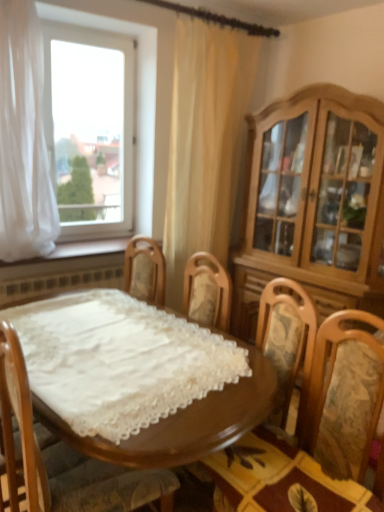
What do you see at coordinates (138, 378) in the screenshot? The width and height of the screenshot is (384, 512). I see `wooden table at center` at bounding box center [138, 378].

What do you see at coordinates (23, 138) in the screenshot?
I see `white sheer curtain at left, which appears as the 2th curtain when viewed from the right` at bounding box center [23, 138].

Identify the location of transparent glass window at upper left. (137, 91).

Is wooden at lower left looking in the opposite direction of wooden chair with floral cushion at center?

No, wooden at lower left's orientation is not away from wooden chair with floral cushion at center.

Is wooden at lower left directly adjacent to wooden chair with floral cushion at center?

wooden at lower left and wooden chair with floral cushion at center are not in contact.

Considering the relative sizes of wooden at lower left and wooden chair with floral cushion at center in the image provided, is wooden at lower left bigger than wooden chair with floral cushion at center?

Actually, wooden at lower left might be smaller than wooden chair with floral cushion at center.

Does point (116, 245) come closer to viewer compared to point (9, 369)?

No, it is not.

Considering the sizes of objects wooden at lower left and wooden table at center in the image provided, who is wider, wooden at lower left or wooden table at center?

wooden table at center is wider.

Do you think wooden at lower left is within wooden table at center, or outside of it?

wooden at lower left cannot be found inside wooden table at center.

Is wooden at lower left next to wooden table at center?

No, wooden at lower left is not making contact with wooden table at center.

Where is `table on the right of wooden at lower left`? table on the right of wooden at lower left is located at coordinates (138, 378).

How far apart are wooden table at center and light brown wood cabinet at right?

The distance of wooden table at center from light brown wood cabinet at right is 4.24 feet.

Is the surface of wooden table at center in direct contact with light brown wood cabinet at right?

wooden table at center and light brown wood cabinet at right are clearly separated.

Is wooden table at center positioned before light brown wood cabinet at right?

Yes, it is.

Considering the relative sizes of wooden table at center and light brown wood cabinet at right in the image provided, is wooden table at center wider than light brown wood cabinet at right?

Yes, wooden table at center is wider than light brown wood cabinet at right.

Between point (208, 134) and point (114, 22), which one is positioned behind?

The point (208, 134) is farther from the camera.

Could you tell me if beige fabric curtain at upper center, which ranks as the first curtain in right-to-left order, is facing transparent glass window at upper left?

No, beige fabric curtain at upper center, which ranks as the first curtain in right-to-left order, does not turn towards transparent glass window at upper left.

Between beige fabric curtain at upper center, which ranks as the first curtain in right-to-left order, and transparent glass window at upper left, which one has smaller width?

transparent glass window at upper left.

Considering the relative sizes of beige fabric curtain at upper center, arranged as the 2th curtain when viewed from the left, and transparent glass window at upper left in the image provided, is beige fabric curtain at upper center, arranged as the 2th curtain when viewed from the left, shorter than transparent glass window at upper left?

In fact, beige fabric curtain at upper center, arranged as the 2th curtain when viewed from the left, may be taller than transparent glass window at upper left.

Is wooden at lower left located outside light brown wood cabinet at right?

Yes, wooden at lower left is outside of light brown wood cabinet at right.

Which is behind, point (80, 245) or point (269, 278)?

Positioned behind is point (269, 278).

Find the location of a particular element. Image resolution: width=384 pixels, height=512 pixels. cabinetry in front of the wooden at lower left is located at coordinates (313, 204).

Considering the sizes of objects wooden at lower left and light brown wood cabinet at right in the image provided, who is bigger, wooden at lower left or light brown wood cabinet at right?

Bigger between the two is light brown wood cabinet at right.

Is point (0, 148) positioned behind point (201, 213)?

No, (0, 148) is in front of (201, 213).

Would you consider white sheer curtain at left, marked as the 1th curtain in a left-to-right arrangement, to be distant from beige fabric curtain at upper center, arranged as the 2th curtain when viewed from the left?

white sheer curtain at left, marked as the 1th curtain in a left-to-right arrangement, is positioned a significant distance from beige fabric curtain at upper center, arranged as the 2th curtain when viewed from the left.

In order to click on curtain positioned vertically above the beige fabric curtain at upper center, which ranks as the first curtain in right-to-left order (from a real-world perspective) in this screenshot , I will do `click(23, 138)`.

From a real-world perspective, is white sheer curtain at left, which appears as the 2th curtain when viewed from the right, positioned above or below beige fabric curtain at upper center, arranged as the 2th curtain when viewed from the left?

From a real-world perspective, white sheer curtain at left, which appears as the 2th curtain when viewed from the right, is physically above beige fabric curtain at upper center, arranged as the 2th curtain when viewed from the left.

From the image's perspective, is wooden chair with floral cushion at center positioned above or below wooden at lower left?

Clearly, from the image's perspective, wooden chair with floral cushion at center is below wooden at lower left.

Does wooden chair with floral cushion at center turn towards wooden at lower left?

No, wooden chair with floral cushion at center is not oriented towards wooden at lower left.

From a real-world perspective, which is physically below, wooden chair with floral cushion at center or wooden at lower left?

wooden chair with floral cushion at center, from a real-world perspective.

Locate an element on the screen. chair that is under the wooden at lower left (from a real-world perspective) is located at coordinates (77, 465).

In order to click on window sill that appears above the wooden table at center (from the image's perspective) in this screenshot , I will do `click(79, 250)`.

Considering their positions, is white sheer curtain at left, marked as the 1th curtain in a left-to-right arrangement, positioned closer to light brown wood cabinet at right than wooden at lower left?

wooden at lower left lies closer to light brown wood cabinet at right than the other object.

From the image, which object appears to be nearer to beige fabric curtain at upper center, which ranks as the first curtain in right-to-left order, wooden at lower left or transparent glass window at upper left?

transparent glass window at upper left.

Looking at the image, which one is located closer to wooden table at center, wooden swivel chair at center or light brown wood cabinet at right?

The object closer to wooden table at center is wooden swivel chair at center.

Based on their spatial positions, is light brown wood cabinet at right or white sheer curtain at left, marked as the 1th curtain in a left-to-right arrangement, further from wooden at lower left?

Based on the image, light brown wood cabinet at right appears to be further to wooden at lower left.

Which object lies nearer to the anchor point wooden table at center, beige fabric curtain at upper center, arranged as the 2th curtain when viewed from the left, or wooden swivel chair at center?

wooden swivel chair at center.

In the scene shown: When comparing their distances from wooden at lower left, does white sheer curtain at left, which appears as the 2th curtain when viewed from the right, or beige fabric curtain at upper center, arranged as the 2th curtain when viewed from the left, seem further?

The object further to wooden at lower left is beige fabric curtain at upper center, arranged as the 2th curtain when viewed from the left.

Based on their spatial positions, is wooden at lower left or beige fabric curtain at upper center, which ranks as the first curtain in right-to-left order, closer to wooden chair with floral cushion at center?

The object closer to wooden chair with floral cushion at center is wooden at lower left.

When comparing their distances from white sheer curtain at left, which appears as the 2th curtain when viewed from the right, does wooden at lower left or wooden swivel chair at center seem further?

The object further to white sheer curtain at left, which appears as the 2th curtain when viewed from the right, is wooden swivel chair at center.

You are a GUI agent. You are given a task and a screenshot of the screen. Output one action in this format:
    pyautogui.click(x=<x>, y=<y>)
    Task: Click on the window sill between white sheer curtain at left, which appears as the 2th curtain when viewed from the right, and wooden table at center from top to bottom
    
    Given the screenshot: What is the action you would take?
    pyautogui.click(x=79, y=250)

This screenshot has width=384, height=512. In order to click on table between white sheer curtain at left, marked as the 1th curtain in a left-to-right arrangement, and light brown wood cabinet at right from left to right in this screenshot , I will do `click(138, 378)`.

This screenshot has height=512, width=384. I want to click on table located between wooden chair with floral cushion at center and wooden swivel chair at center in the left-right direction, so click(x=138, y=378).

At what (x,y) coordinates should I click in order to perform the action: click on swivel chair situated between wooden at lower left and light brown wood cabinet at right from left to right. Please return your answer as a coordinate pair (x, y). This screenshot has width=384, height=512. Looking at the image, I should click on (319, 430).